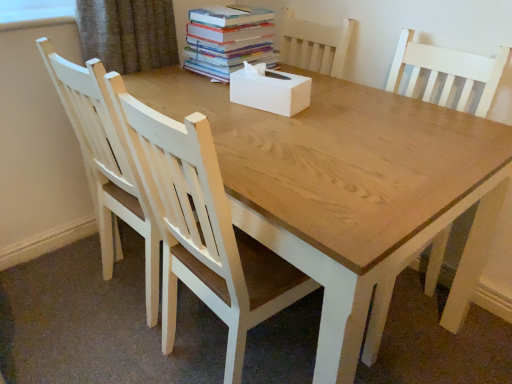
You are a GUI agent. You are given a task and a screenshot of the screen. Output one action in this format:
    pyautogui.click(x=<x>, y=<y>)
    Task: Click on the vacant space in front of white matte tissue box at center
    This screenshot has height=384, width=512.
    Given the screenshot: What is the action you would take?
    pyautogui.click(x=270, y=120)